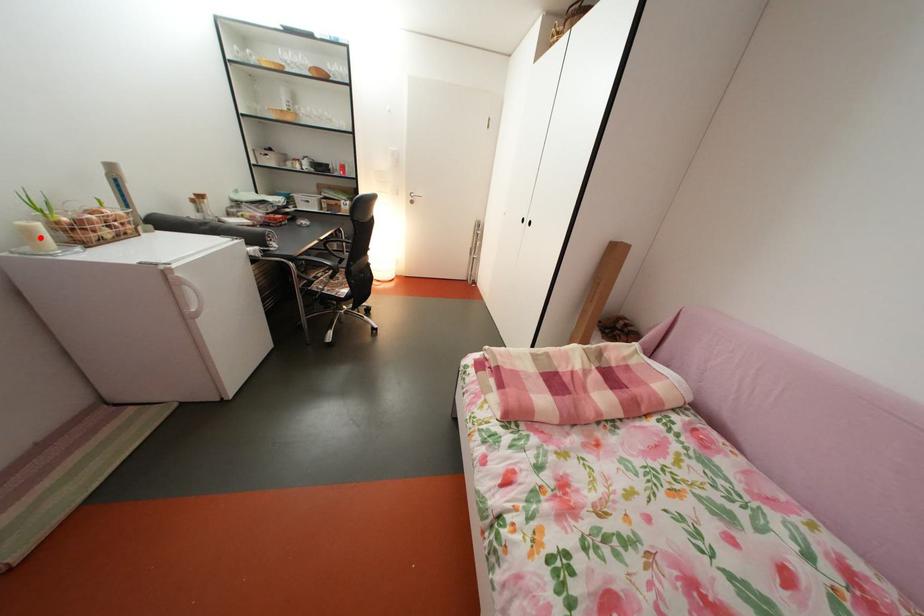
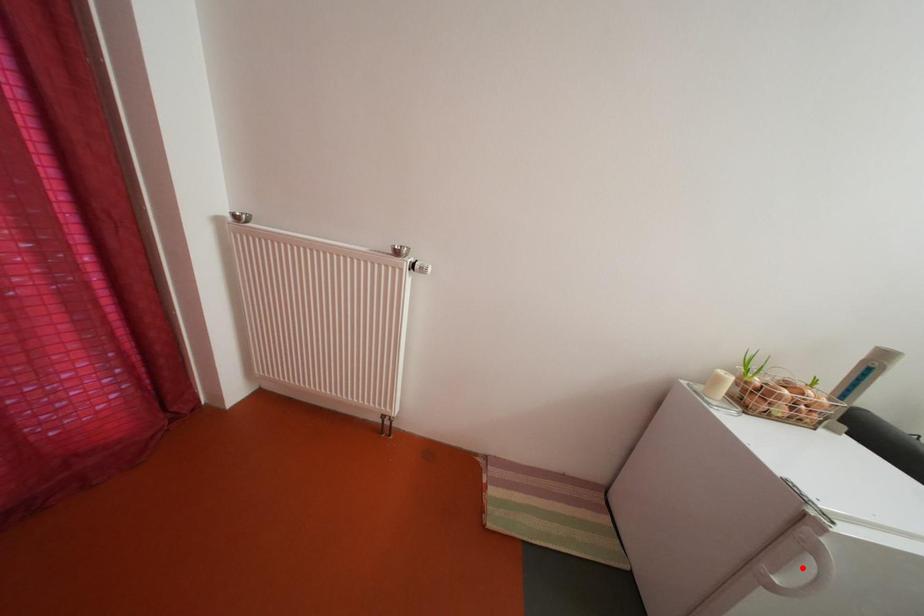
I am providing you with two images of the same scene from different viewpoints. A red point is marked on the first image and another point is marked on the second image. Are the points marked in image1 and image2 representing the same 3D position?

No